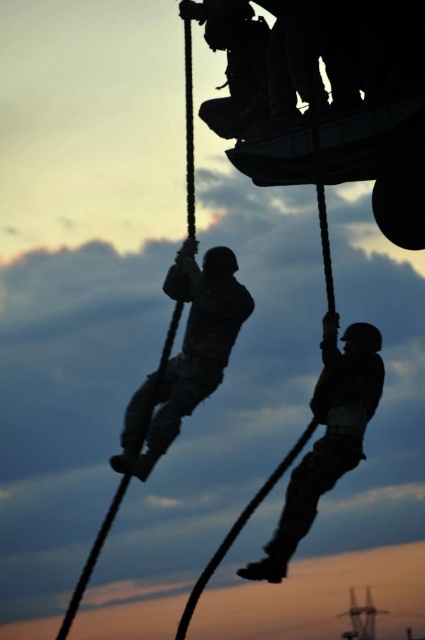
You are a military observer assessing the positioning of soldiers during a rappelling exercise. Which soldier is positioned to the left of the other between the silhouette uniform at center and the camouflage fabric soldier at right?

The silhouette uniform at center is positioned on the left side of camouflage fabric soldier at right.

You are a military observer analyzing the scene. Which soldier is positioned higher in the air between the silhouette uniform at center and the camouflage fabric soldier at right?

The silhouette uniform at center is positioned higher in the air than the camouflage fabric soldier at right because it is located above the camouflage fabric soldier at right.